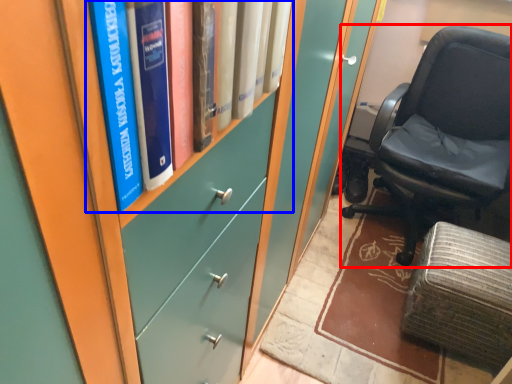
Question: Which of the following is the farthest to the observer, chair (highlighted by a red box) or book (highlighted by a blue box)?

Choices:
 (A) chair
 (B) book

Answer: (A)